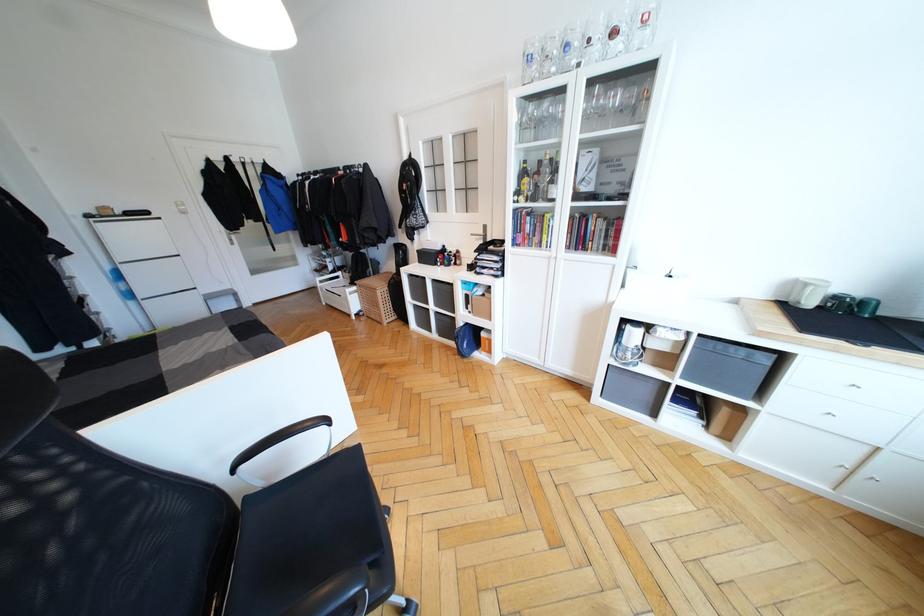
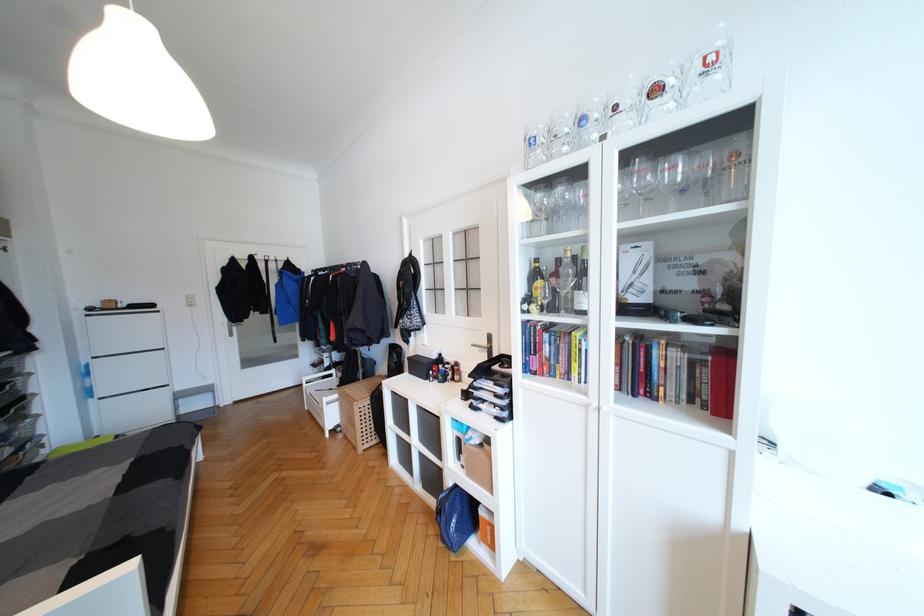
In the second image, find the point that corresponds to [469,333] in the first image.

(460, 501)